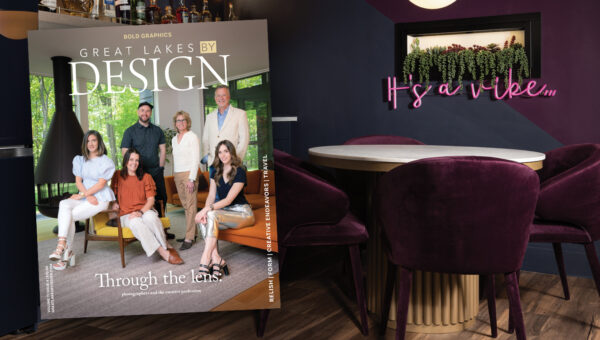
You are a GUI agent. You are given a task and a screenshot of the screen. Output one action in this format:
    pyautogui.click(x=<x>, y=<y>)
    Task: Click on the table
    
    Given the screenshot: What is the action you would take?
    pyautogui.click(x=437, y=318)